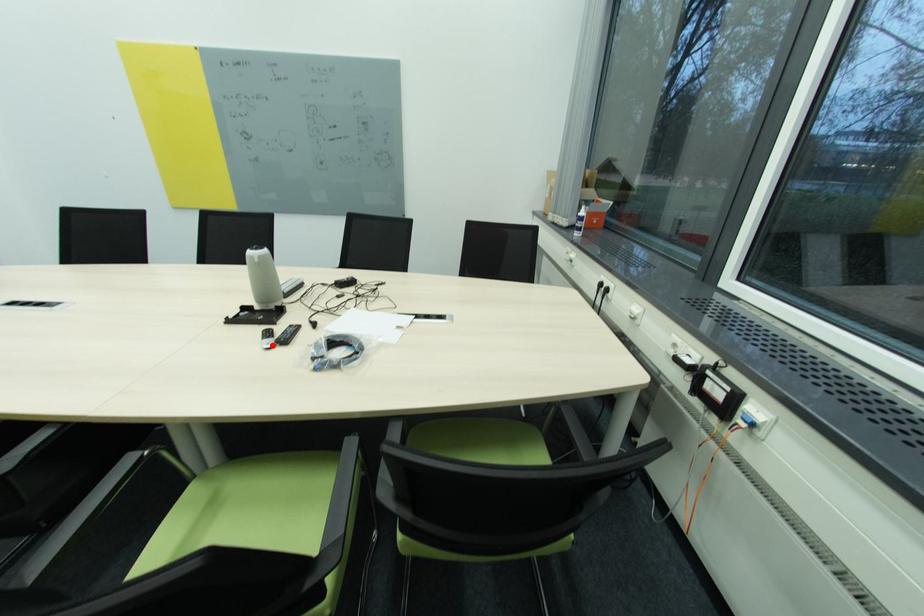
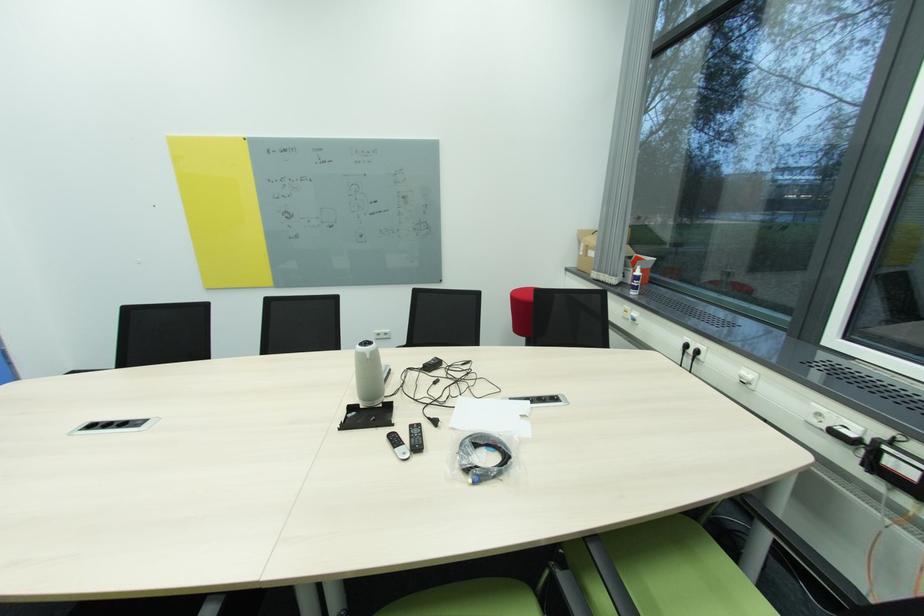
Find the pixel in the second image that matches the highlighted location in the first image.

(408, 455)